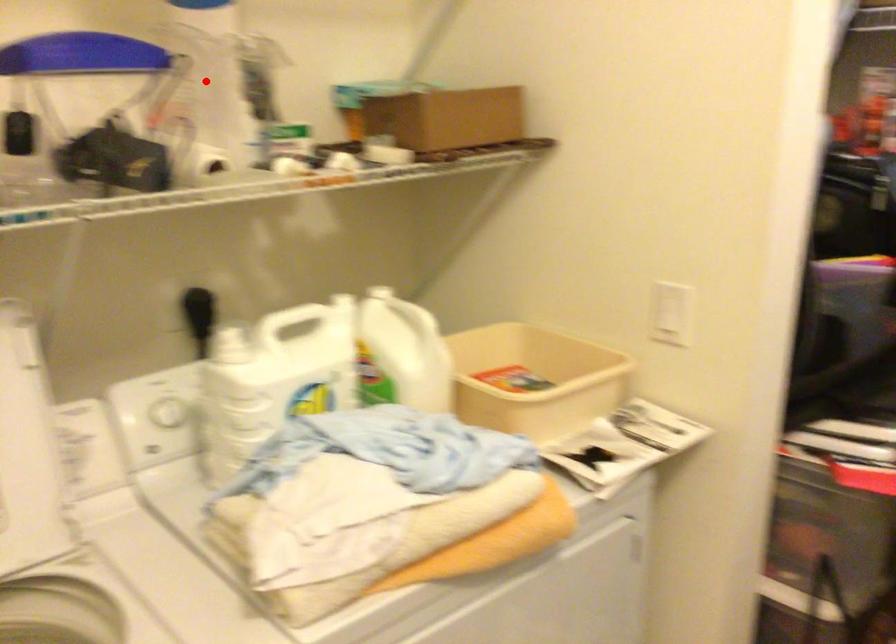
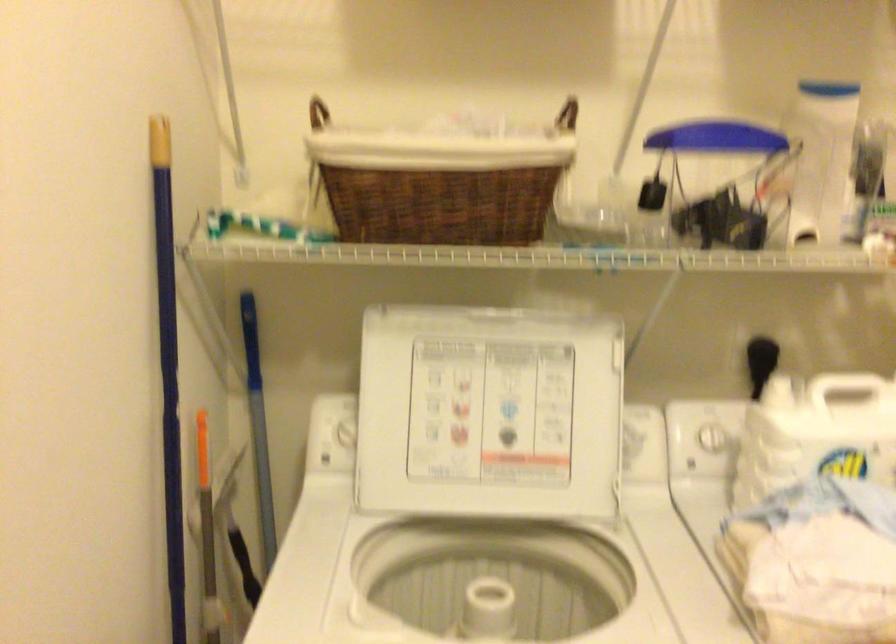
The point at the highlighted location is marked in the first image. Where is the corresponding point in the second image?

(821, 158)